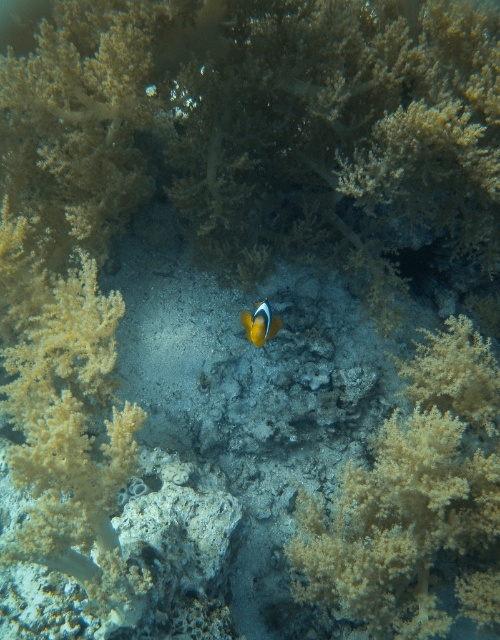
You are a marine biologist studying the coral reef. You observe a translucent yellow coral at center. Based on its coordinates, can you determine if it is positioned closer to the top or bottom of the image?

The translucent yellow coral at center has coordinates at point 0.773 on the x and 0.820 on the y axis. Since the y coordinate is closer to 1, which typically represents the bottom of the image, the translucent yellow coral at center is positioned closer to the bottom of the image.

In the scene shown: You are a diver observing the underwater scene. You see the soft yellow coral at left and the orange matte fish at center. Which object is located to the left of the other?

The soft yellow coral at left is positioned on the left side of the orange matte fish at center, so it is located to the left of the fish.